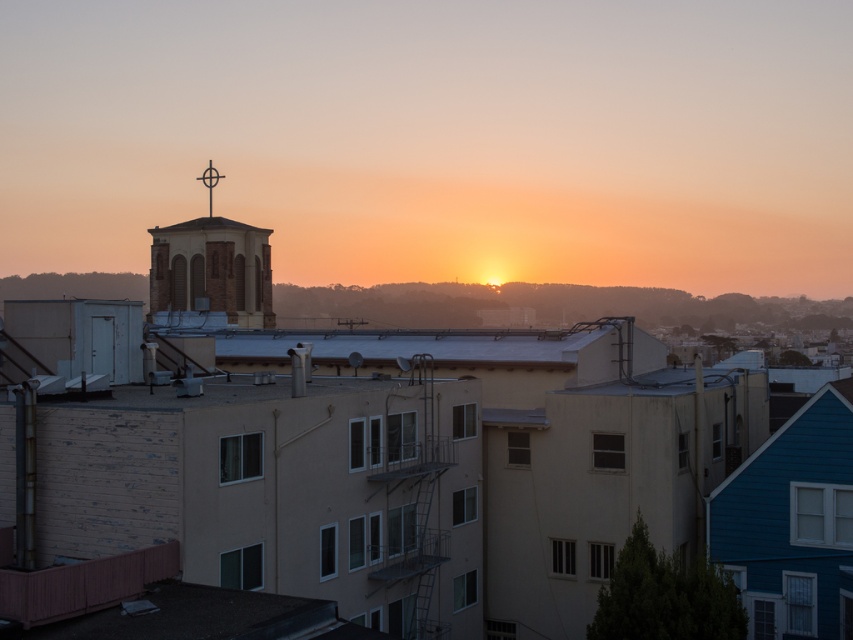
Measure the distance from brick steeple at upper center to metallic cross at upper center.

They are 20.52 feet apart.

Is point (244, 275) closer to camera compared to point (209, 173)?

That is False.

Between point (238, 236) and point (218, 180), which one is positioned in front?

Point (218, 180) is more forward.

The height and width of the screenshot is (640, 853). What are the coordinates of `brick steeple at upper center` in the screenshot? It's located at (212, 266).